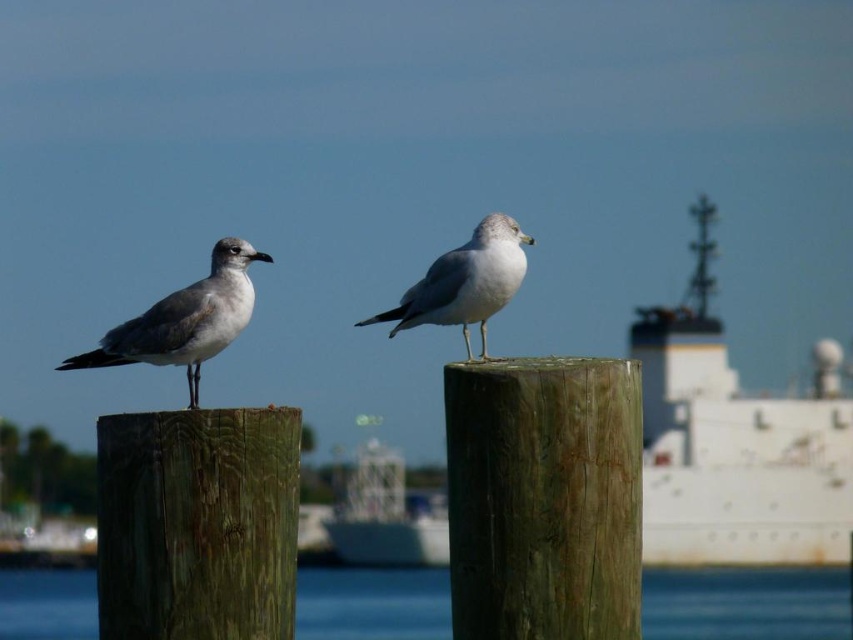
You are a birdwatcher observing the gray matte seagull at left and the brown wood post at left. Which object is wider?

The gray matte seagull at left is wider than the brown wood post at left.

You are standing at the origin point in the image and looking towards the ship. Which point, point (567, 420) or point (3, 624), is closer to you?

Point (567, 420) is in front of point (3, 624), so it is closer to you.

You are a photographer trying to capture both the gray matte seagull at left and the white matte seagull at center in a single shot. Based on their sizes in the image, which seagull should you focus on first to ensure both are in frame?

The gray matte seagull at left occupies less space than the white matte seagull at center, so you should focus on the white matte seagull at center first to ensure both fit in the frame.